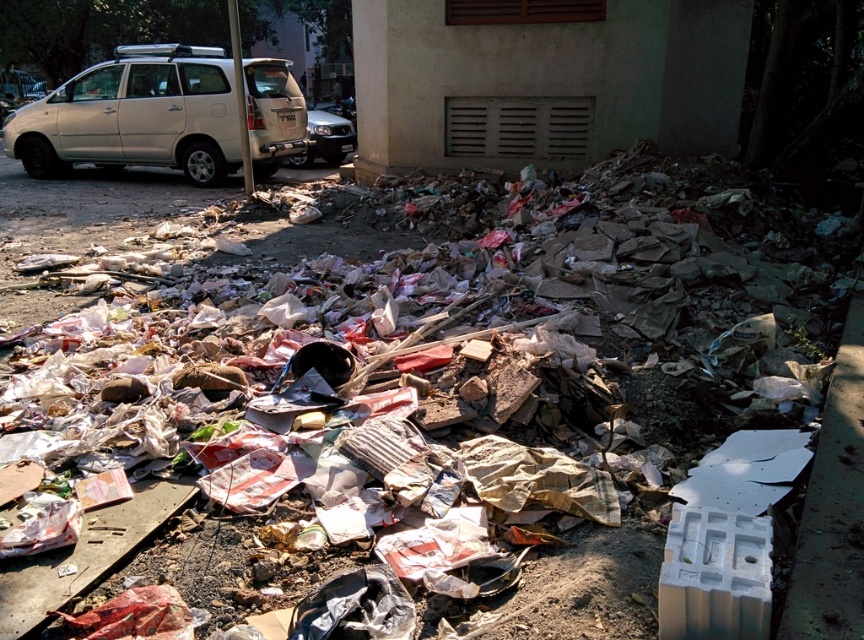
Can you confirm if silver metallic van at upper left is wider than silver metallic suv at center?

Correct, the width of silver metallic van at upper left exceeds that of silver metallic suv at center.

Is silver metallic van at upper left positioned at the back of silver metallic suv at center?

No, silver metallic van at upper left is in front of silver metallic suv at center.

I want to click on silver metallic van at upper left, so click(135, 115).